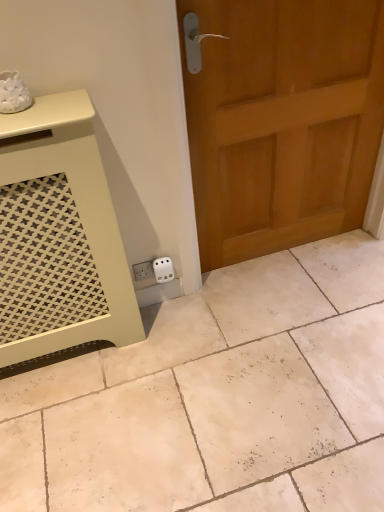
Question: Should I look upward or downward to see white matte tile at lower left?

Choices:
 (A) down
 (B) up

Answer: (A)

Question: Is white matte tile at lower left oriented towards white plastic electric outlet at lower center?

Choices:
 (A) yes
 (B) no

Answer: (B)

Question: From a real-world perspective, is white matte tile at lower left below white plastic electric outlet at lower center?

Choices:
 (A) yes
 (B) no

Answer: (A)

Question: Is white matte tile at lower left positioned beyond the bounds of white plastic electric outlet at lower center?

Choices:
 (A) yes
 (B) no

Answer: (A)

Question: Does white matte tile at lower left come behind white plastic electric outlet at lower center?

Choices:
 (A) no
 (B) yes

Answer: (A)

Question: From the image's perspective, is white matte tile at lower left beneath white plastic electric outlet at lower center?

Choices:
 (A) yes
 (B) no

Answer: (A)

Question: Is white matte tile at lower left at the left side of white plastic electric outlet at lower center?

Choices:
 (A) yes
 (B) no

Answer: (B)

Question: From the image's perspective, does white plastic electric outlet at lower center appear lower than wooden door at right?

Choices:
 (A) no
 (B) yes

Answer: (B)

Question: Is white plastic electric outlet at lower center facing towards wooden door at right?

Choices:
 (A) no
 (B) yes

Answer: (A)

Question: Does white plastic electric outlet at lower center have a larger size compared to wooden door at right?

Choices:
 (A) no
 (B) yes

Answer: (A)

Question: From a real-world perspective, is white plastic electric outlet at lower center positioned under wooden door at right based on gravity?

Choices:
 (A) yes
 (B) no

Answer: (A)

Question: From a real-world perspective, is white plastic electric outlet at lower center physically above wooden door at right?

Choices:
 (A) no
 (B) yes

Answer: (A)

Question: Is white plastic electric outlet at lower center at the left side of wooden door at right?

Choices:
 (A) yes
 (B) no

Answer: (A)

Question: Is matte cream vanity at lower left located within wooden door at right?

Choices:
 (A) no
 (B) yes

Answer: (A)